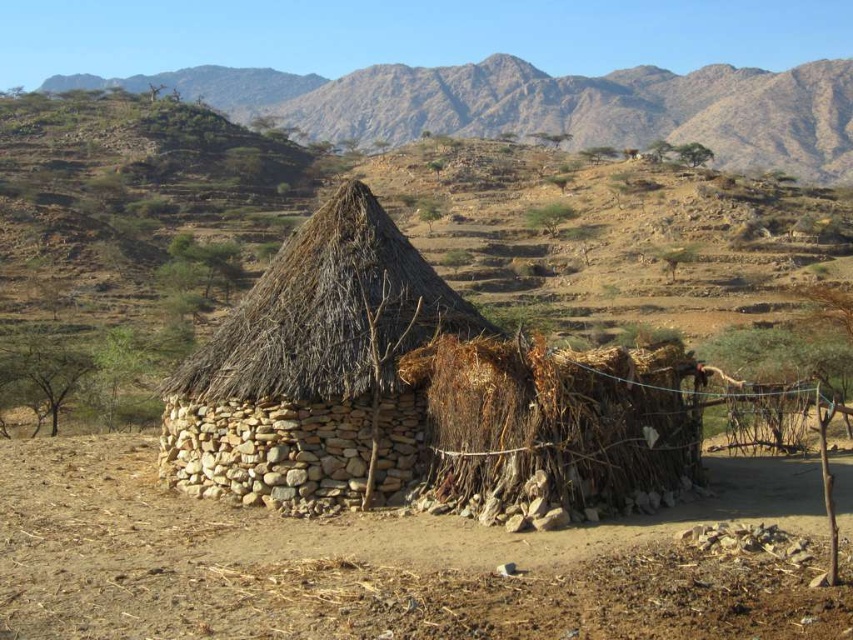
You are standing at the origin point in the image. Where is the brown soil at center located in terms of its 2D coordinates?

The brown soil at center is located at the 2D coordinates of point (372, 563).

You are standing at the base of the brown rocky mountain at upper center and want to take a photo of it using a camera that has a maximum focus range of 150 meters. Will the camera be able to focus on the mountain?

The brown rocky mountain at upper center and camera are 144.61 meters apart from each other. Since the camera can focus up to 150 meters, it will be able to focus on the mountain as the distance is within the maximum range.